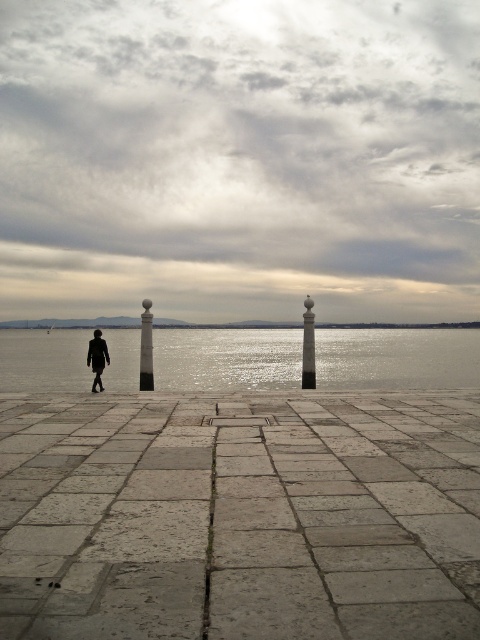
You are standing on the waterfront promenade and notice the reflective silver water at center and the dark matte jacket at center. Which object takes up more space in the scene?

The reflective silver water at center has a larger size compared to the dark matte jacket at center, so it takes up more space in the scene.

You are standing at the waterfront promenade and see two points marked on the walkway. The first point is at coordinate point (328, 378) and the second is at point (96, 332). Which point is closer to your current position?

Point (96, 332) is closer to your current position because it is closer to the viewer than point (328, 378), which is further away.